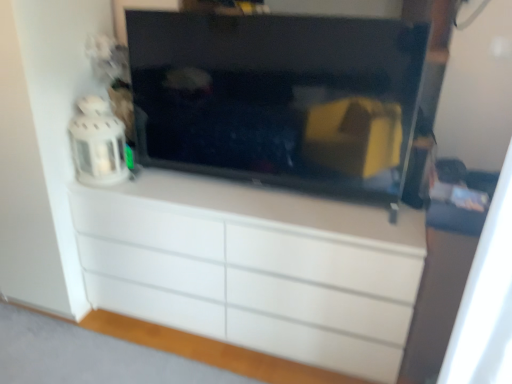
Question: Is white fabric curtain at right shorter than white glossy chest of drawers at center?

Choices:
 (A) no
 (B) yes

Answer: (A)

Question: Is white glossy chest of drawers at center surrounded by white fabric curtain at right?

Choices:
 (A) yes
 (B) no

Answer: (B)

Question: From the image's perspective, is white fabric curtain at right located beneath white glossy chest of drawers at center?

Choices:
 (A) no
 (B) yes

Answer: (A)

Question: From a real-world perspective, is white fabric curtain at right physically below white glossy chest of drawers at center?

Choices:
 (A) yes
 (B) no

Answer: (B)

Question: Can you confirm if white fabric curtain at right is positioned to the right of white glossy chest of drawers at center?

Choices:
 (A) no
 (B) yes

Answer: (B)

Question: Is white fabric curtain at right looking in the opposite direction of white glossy chest of drawers at center?

Choices:
 (A) yes
 (B) no

Answer: (B)

Question: Can you confirm if white glossy chest of drawers at center is shorter than white fabric curtain at right?

Choices:
 (A) no
 (B) yes

Answer: (B)

Question: Is white glossy chest of drawers at center turned away from white fabric curtain at right?

Choices:
 (A) yes
 (B) no

Answer: (B)

Question: Does white glossy chest of drawers at center come in front of white fabric curtain at right?

Choices:
 (A) no
 (B) yes

Answer: (A)

Question: Is white glossy chest of drawers at center not inside white fabric curtain at right?

Choices:
 (A) yes
 (B) no

Answer: (A)

Question: Does white glossy chest of drawers at center have a larger size compared to white fabric curtain at right?

Choices:
 (A) no
 (B) yes

Answer: (B)

Question: Is there a large distance between white glossy chest of drawers at center and white fabric curtain at right?

Choices:
 (A) yes
 (B) no

Answer: (B)

Question: Does white glossy chest of drawers at center have a greater width compared to black glossy tv at center?

Choices:
 (A) yes
 (B) no

Answer: (A)